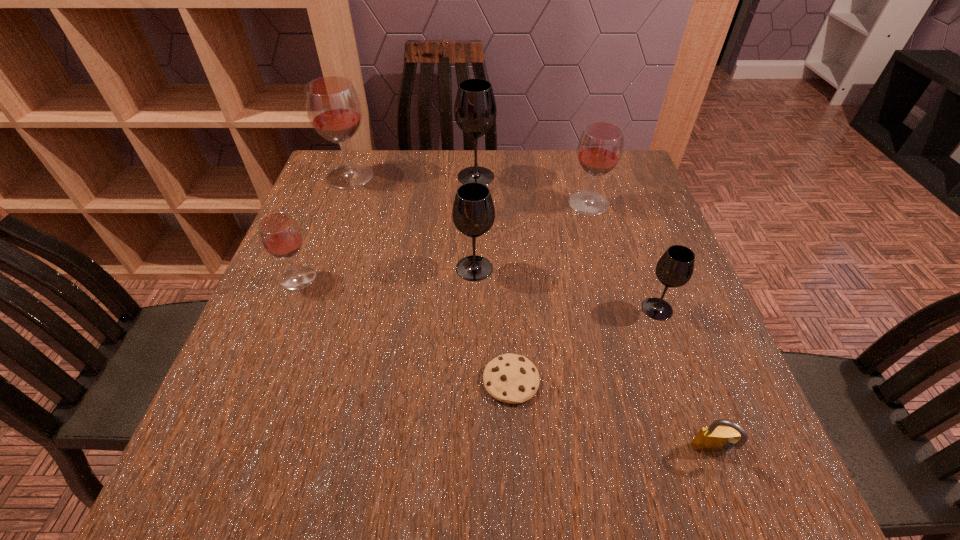
Identify the location of the farthest gray wineglass. (475, 111).

The height and width of the screenshot is (540, 960). What are the coordinates of `the farthest red wineglass` in the screenshot? It's located at pyautogui.click(x=333, y=107).

Identify the location of the second biggest red wineglass. The image size is (960, 540). (600, 147).

The image size is (960, 540). Identify the location of the third farthest object. [600, 147].

In order to click on the second biggest gray wineglass in this screenshot , I will do `click(473, 213)`.

Locate an element on the screen. This screenshot has width=960, height=540. the smallest red wineglass is located at coordinates (280, 235).

Where is `the nearest wineglass`? Image resolution: width=960 pixels, height=540 pixels. the nearest wineglass is located at coordinates (675, 267).

I want to click on the third nearest object, so click(675, 267).

Find the location of a particular element. the seventh tallest object is located at coordinates (714, 438).

The height and width of the screenshot is (540, 960). What are the coordinates of `the nearest object` in the screenshot? It's located at (714, 438).